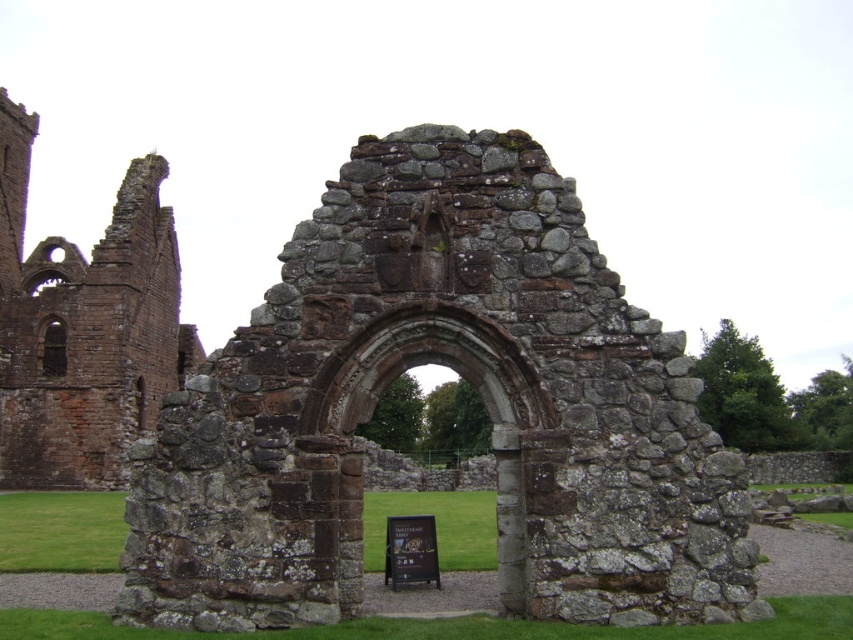
Question: Can you confirm if brown stone arch at center is positioned to the left of wooden signboard at center?

Choices:
 (A) yes
 (B) no

Answer: (B)

Question: Which object appears farthest from the camera in this image?

Choices:
 (A) rustic stone archway at center
 (B) brown stone arch at center

Answer: (A)

Question: Among these objects, which one is nearest to the camera?

Choices:
 (A) wooden signboard at center
 (B) rustic stone archway at center
 (C) brown stone arch at center
 (D) brown stone arch at left

Answer: (C)

Question: Can you confirm if brown stone arch at center is positioned above wooden signboard at center?

Choices:
 (A) no
 (B) yes

Answer: (B)

Question: Observing the image, what is the correct spatial positioning of rustic stone archway at center in reference to wooden signboard at center?

Choices:
 (A) below
 (B) above

Answer: (B)

Question: Which of the following is the farthest from the observer?

Choices:
 (A) wooden signboard at center
 (B) brown stone arch at left
 (C) rustic stone archway at center
 (D) brown stone arch at center

Answer: (B)